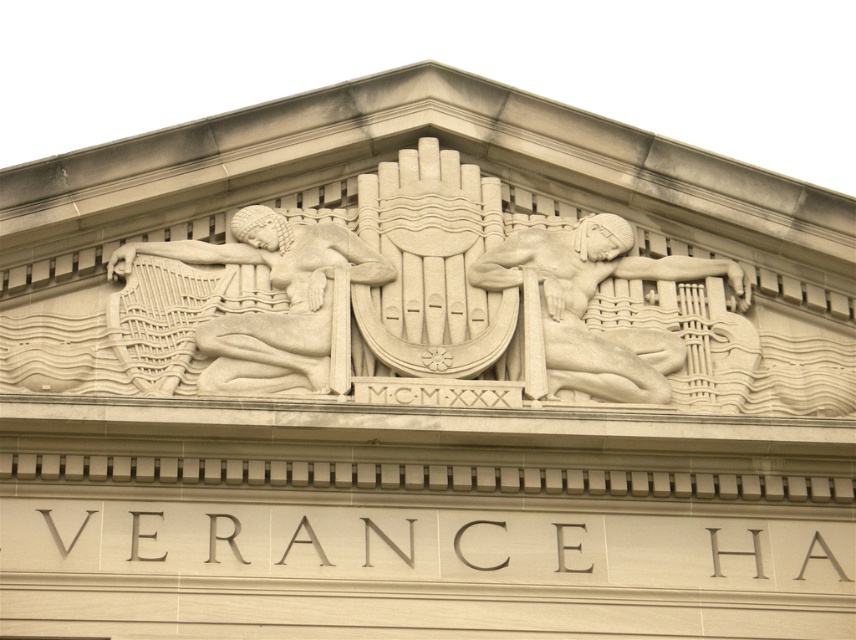
Question: Which point is closer to the camera?

Choices:
 (A) (583, 220)
 (B) (337, 304)

Answer: (B)

Question: Can you confirm if white stone harp at center is thinner than white stone reclining figure at center?

Choices:
 (A) no
 (B) yes

Answer: (B)

Question: Is white stone harp at center bigger than white stone reclining figure at center?

Choices:
 (A) yes
 (B) no

Answer: (B)

Question: Which object appears closest to the camera in this image?

Choices:
 (A) white stone reclining figure at center
 (B) white stone harp at center

Answer: (B)

Question: Does white stone harp at center have a larger size compared to white stone reclining figure at center?

Choices:
 (A) no
 (B) yes

Answer: (A)